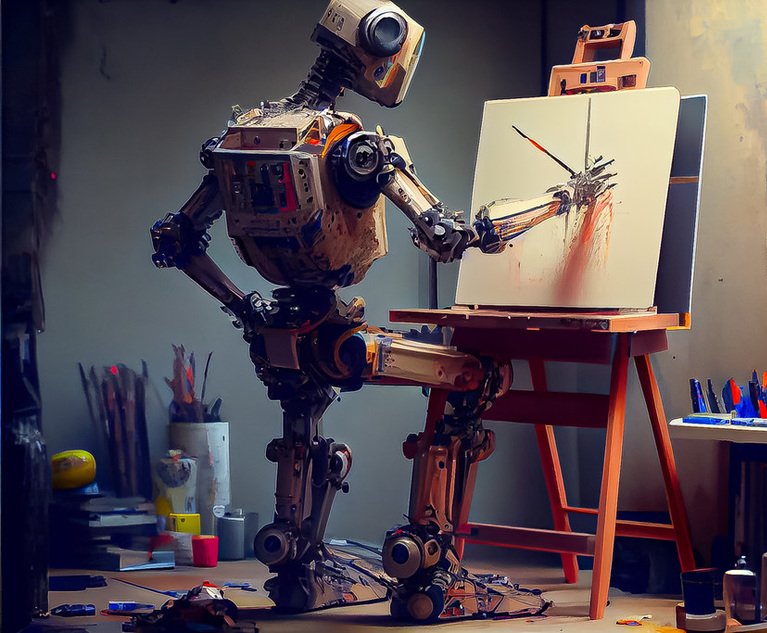
Find the location of a particular element. This screenshot has height=633, width=767. easel is located at coordinates (614, 420).